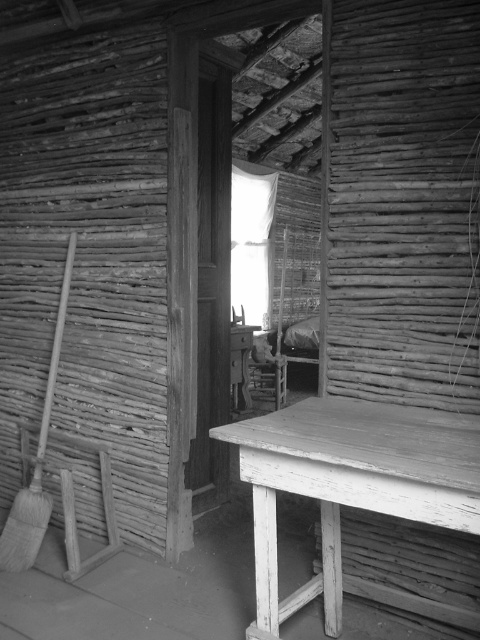
You are an interior designer planning to place a new decorative item in this rustic room. You have a large vase that is 1.2 meters wide. You see the transparent glass window at center and the wooden broom at left. Which object should you consider in terms of width to ensure the vase can fit next to it without blocking the window?

The transparent glass window at center is wider than the wooden broom at left, so the vase should be placed next to the window since it has more space available.

You are standing in the rustic structure and want to move from the wooden broom at left to the smooth white wooden table at center. Which direction should you move to reach the table?

You should move to the right to reach the smooth white wooden table at center because it is located to the right of the wooden broom at left.

You are standing at the entrance of this rustic structure and see two points marked in the image. If you were to walk directly toward the point labeled point (x=468, y=516), would you pass by the point labeled point (x=244, y=173) first?

No, because point (x=468, y=516) is in front of point (x=244, y=173), so walking toward point (x=468, y=516) would not require passing point (x=244, y=173) first.